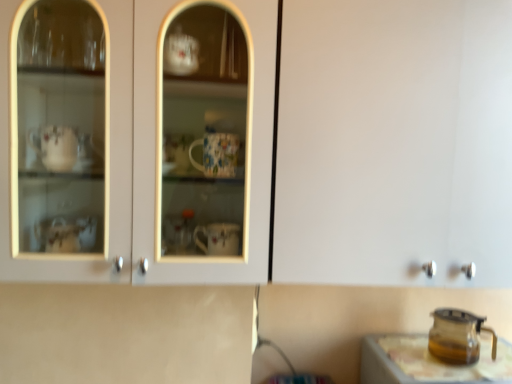
Question: From the image's perspective, is translucent glass table at lower right positioned above or below transparent glass carafe at lower right?

Choices:
 (A) above
 (B) below

Answer: (B)

Question: Considering the relative positions of translucent glass table at lower right and transparent glass carafe at lower right in the image provided, is translucent glass table at lower right to the left or to the right of transparent glass carafe at lower right?

Choices:
 (A) left
 (B) right

Answer: (B)

Question: Do you think translucent glass table at lower right is within transparent glass carafe at lower right, or outside of it?

Choices:
 (A) inside
 (B) outside

Answer: (B)

Question: From the image's perspective, is transparent glass carafe at lower right positioned above or below translucent glass table at lower right?

Choices:
 (A) below
 (B) above

Answer: (B)

Question: Is transparent glass carafe at lower right inside the boundaries of translucent glass table at lower right, or outside?

Choices:
 (A) inside
 (B) outside

Answer: (B)

Question: In the image, is transparent glass carafe at lower right on the left side or the right side of translucent glass table at lower right?

Choices:
 (A) right
 (B) left

Answer: (B)

Question: Considering the positions of transparent glass carafe at lower right and translucent glass table at lower right in the image, is transparent glass carafe at lower right taller or shorter than translucent glass table at lower right?

Choices:
 (A) short
 (B) tall

Answer: (A)